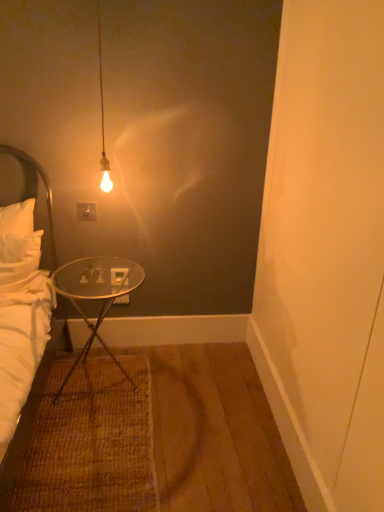
Question: Would you say transparent glass table at lower left contains white fabric headboard at left?

Choices:
 (A) yes
 (B) no

Answer: (B)

Question: Is transparent glass table at lower left positioned with its back to white fabric headboard at left?

Choices:
 (A) no
 (B) yes

Answer: (A)

Question: Does transparent glass table at lower left come behind white fabric headboard at left?

Choices:
 (A) no
 (B) yes

Answer: (A)

Question: Does transparent glass table at lower left appear on the left side of white fabric headboard at left?

Choices:
 (A) yes
 (B) no

Answer: (B)

Question: Does transparent glass table at lower left appear on the right side of white fabric headboard at left?

Choices:
 (A) no
 (B) yes

Answer: (B)

Question: From the image's perspective, is transparent glass table at lower left above white fabric headboard at left?

Choices:
 (A) no
 (B) yes

Answer: (A)

Question: Considering the relative sizes of white soft bed at left and transparent glass table at lower left in the image provided, is white soft bed at left taller than transparent glass table at lower left?

Choices:
 (A) no
 (B) yes

Answer: (B)

Question: From the image's perspective, is white soft bed at left over transparent glass table at lower left?

Choices:
 (A) no
 (B) yes

Answer: (B)

Question: Is white soft bed at left turned away from transparent glass table at lower left?

Choices:
 (A) yes
 (B) no

Answer: (B)

Question: From the image's perspective, is white soft bed at left under transparent glass table at lower left?

Choices:
 (A) no
 (B) yes

Answer: (A)

Question: Is there a large distance between white soft bed at left and transparent glass table at lower left?

Choices:
 (A) no
 (B) yes

Answer: (A)

Question: Considering the relative sizes of white soft bed at left and transparent glass table at lower left in the image provided, is white soft bed at left bigger than transparent glass table at lower left?

Choices:
 (A) no
 (B) yes

Answer: (A)

Question: Does white soft bed at left have a lesser width compared to white plastic power outlet at upper center?

Choices:
 (A) yes
 (B) no

Answer: (B)